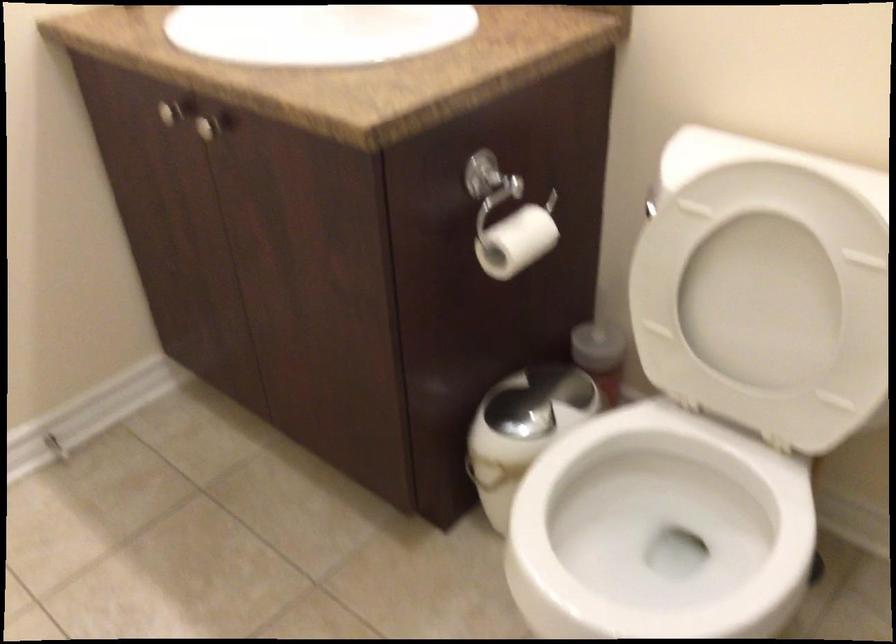
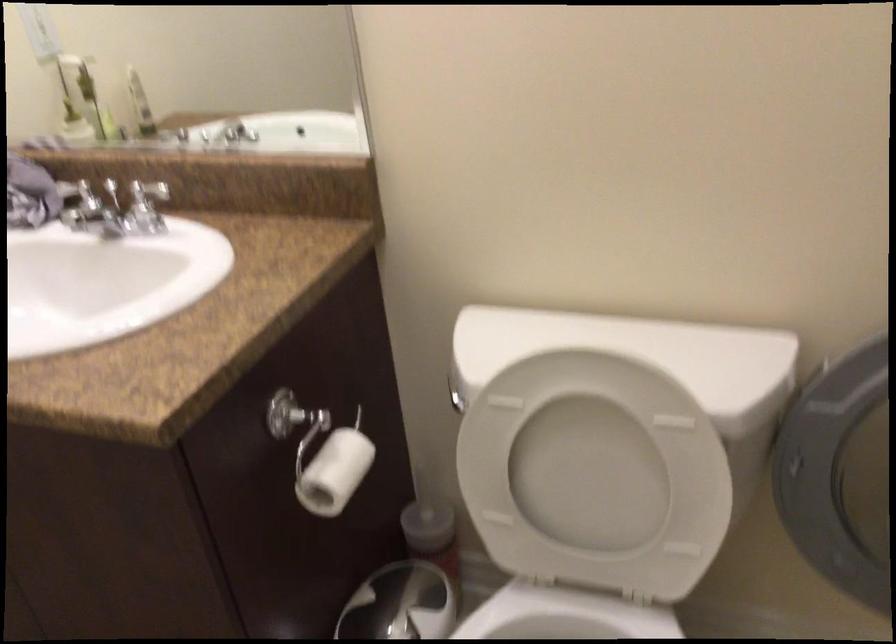
Where in the second image is the point corresponding to (512,239) from the first image?

(334, 471)